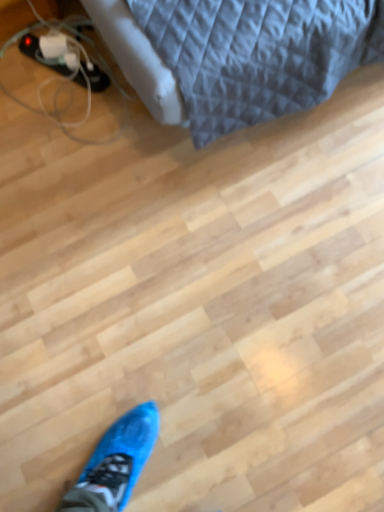
The image size is (384, 512). Describe the element at coordinates (97, 78) in the screenshot. I see `matte black shoe at upper left` at that location.

Measure the distance between point (38, 44) and camera.

A distance of 1.33 meters exists between point (38, 44) and camera.

In order to face matte black shoe at upper left, should I rotate leftwards or rightwards?

Rotate your view left by about 16.907°.

You are a GUI agent. You are given a task and a screenshot of the screen. Output one action in this format:
    pyautogui.click(x=<x>, y=<y>)
    Task: Click on the matte black shoe at upper left
    
    Given the screenshot: What is the action you would take?
    97,78

The width and height of the screenshot is (384, 512). Find the location of `matte black shoe at upper left`. matte black shoe at upper left is located at coordinates (97, 78).